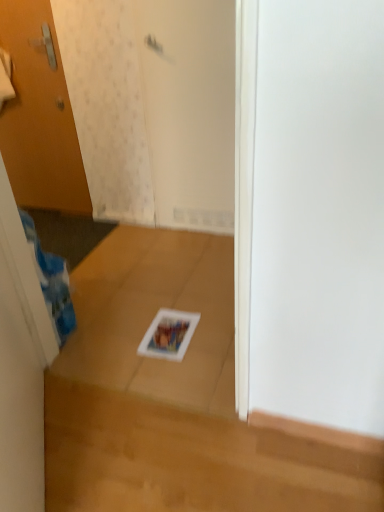
The image size is (384, 512). I want to click on free space underneath matte white magazine at center (from a real-world perspective), so click(170, 334).